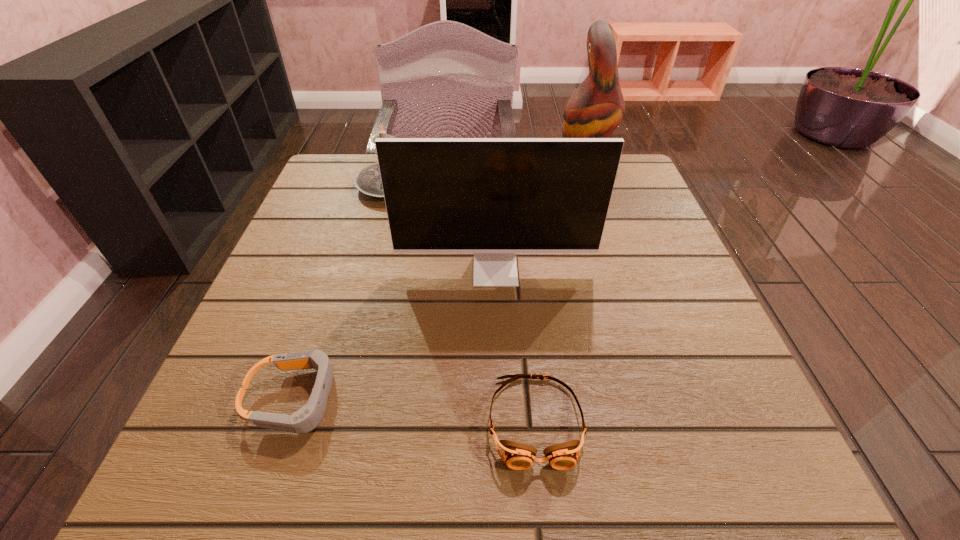
In order to click on vacant area situated on the front of the candle in this screenshot , I will do `click(361, 298)`.

This screenshot has width=960, height=540. Identify the location of vacant space located 0.310m on the front and back of the left goggles. click(552, 399).

Where is `parrot present at the far edge`? The height and width of the screenshot is (540, 960). parrot present at the far edge is located at coordinates (595, 109).

At what (x,y) coordinates should I click in order to perform the action: click on candle that is at the far edge. Please return your answer as a coordinate pair (x, y). The image size is (960, 540). Looking at the image, I should click on (368, 180).

I want to click on candle situated at the left edge, so click(368, 180).

Locate an element on the screen. The height and width of the screenshot is (540, 960). goggles that is at the left edge is located at coordinates (304, 420).

You are a GUI agent. You are given a task and a screenshot of the screen. Output one action in this format:
    pyautogui.click(x=<x>, y=<y>)
    Task: Click on the object that is at the right edge
    Image resolution: width=960 pixels, height=540 pixels.
    Given the screenshot: What is the action you would take?
    pyautogui.click(x=595, y=109)

The image size is (960, 540). Find the location of `object located at the far left corner`. object located at the far left corner is located at coordinates (368, 180).

At what (x,y) coordinates should I click in order to perform the action: click on object present at the near left corner. Please return your answer as a coordinate pair (x, y). Looking at the image, I should click on tap(304, 420).

At what (x,y) coordinates should I click in order to perform the action: click on object situated at the far right corner. Please return your answer as a coordinate pair (x, y). Looking at the image, I should click on (595, 109).